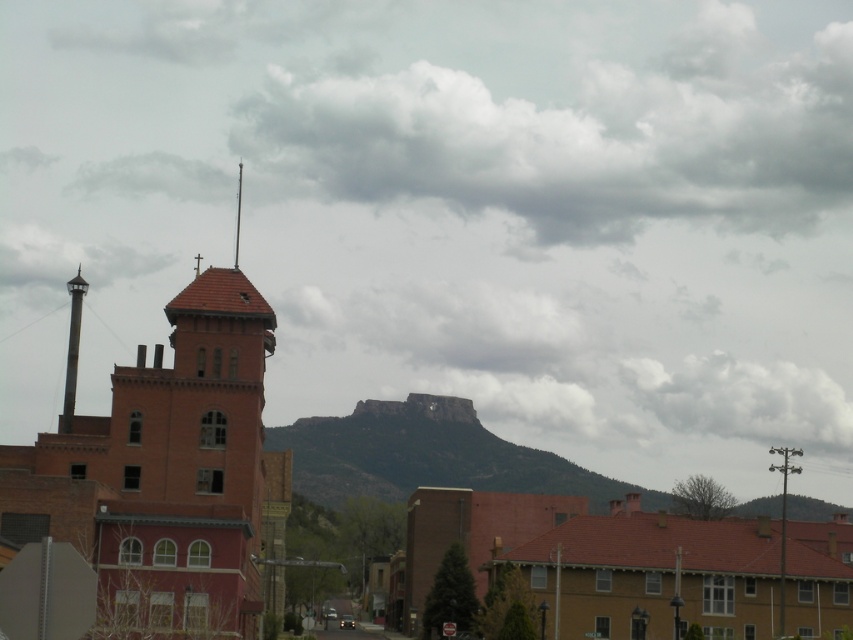
Is point (344, 131) closer to camera compared to point (782, 435)?

That is True.

Can you confirm if cloudy sky at upper center is positioned to the left of cloudy gray cloud at upper center?

Indeed, cloudy sky at upper center is positioned on the left side of cloudy gray cloud at upper center.

Is point (564, 220) farther from viewer compared to point (741, 372)?

No, it is not.

I want to click on cloudy sky at upper center, so click(577, 134).

Does rocky brown mountain at center have a greater width compared to cloudy gray cloud at upper center?

Indeed, rocky brown mountain at center has a greater width compared to cloudy gray cloud at upper center.

Looking at this image, does rocky brown mountain at center have a lesser width compared to cloudy gray cloud at upper center?

Incorrect, rocky brown mountain at center's width is not less than cloudy gray cloud at upper center's.

This screenshot has height=640, width=853. Describe the element at coordinates (428, 456) in the screenshot. I see `rocky brown mountain at center` at that location.

At what (x,y) coordinates should I click in order to perform the action: click on rocky brown mountain at center. Please return your answer as a coordinate pair (x, y). The height and width of the screenshot is (640, 853). Looking at the image, I should click on (428, 456).

What are the coordinates of `rocky brown mountain at center` in the screenshot? It's located at coord(428,456).

Is rocky brown mountain at center to the left of white fluffy cloud at upper center from the viewer's perspective?

In fact, rocky brown mountain at center is to the right of white fluffy cloud at upper center.

Where is `rocky brown mountain at center`? This screenshot has width=853, height=640. rocky brown mountain at center is located at coordinates (428, 456).

Find the location of a particular element. rocky brown mountain at center is located at coordinates (428, 456).